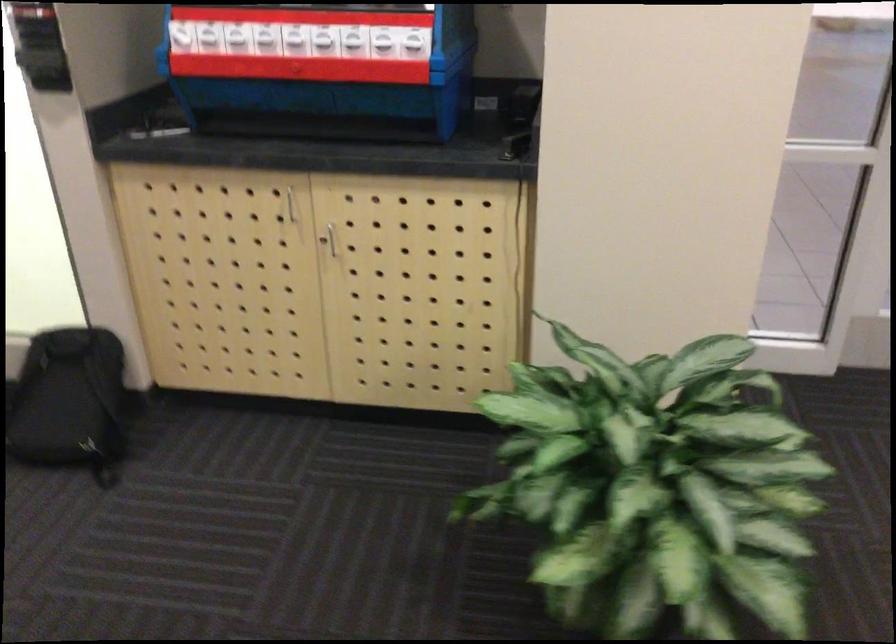
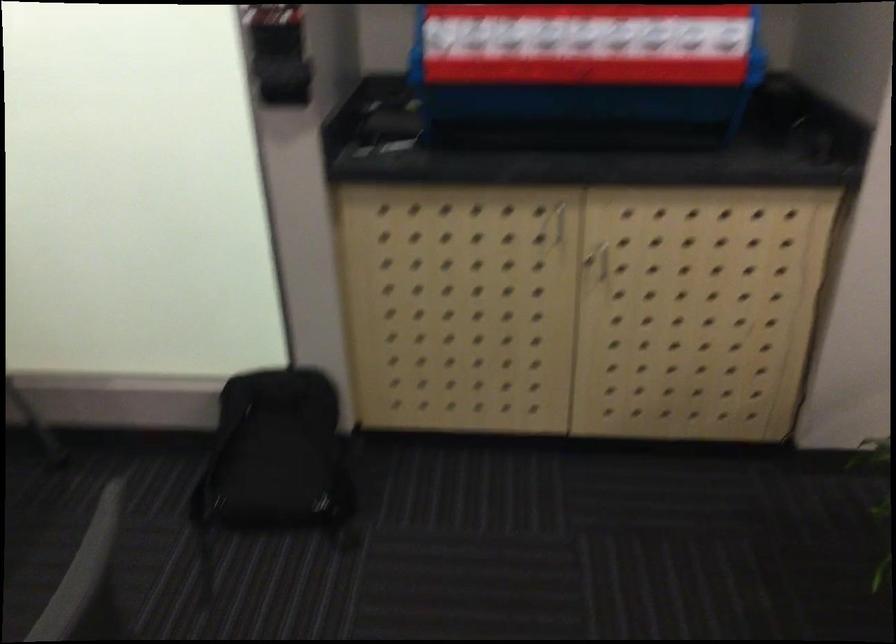
In a continuous first-person perspective shot, in which direction is the camera moving?

The cameraman walked toward left, forward.